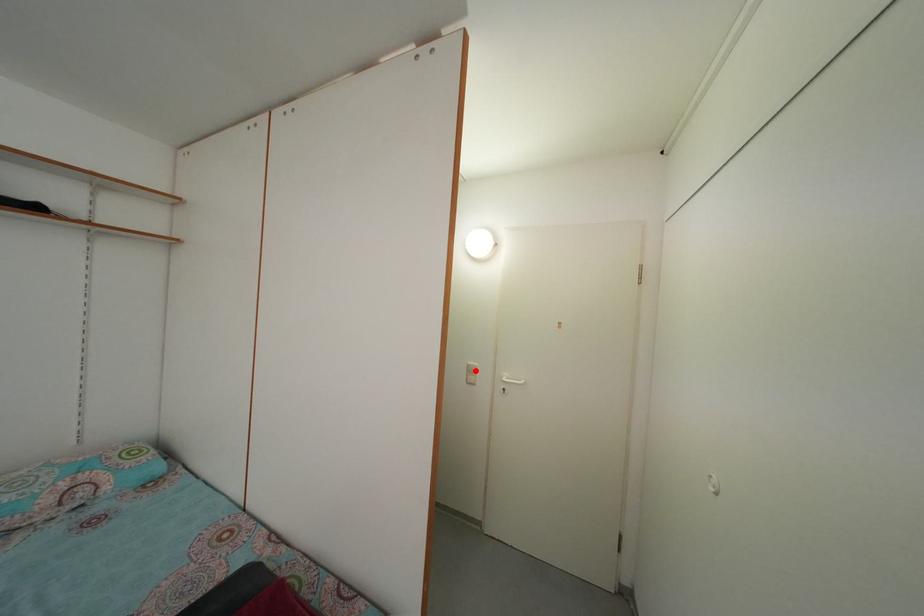
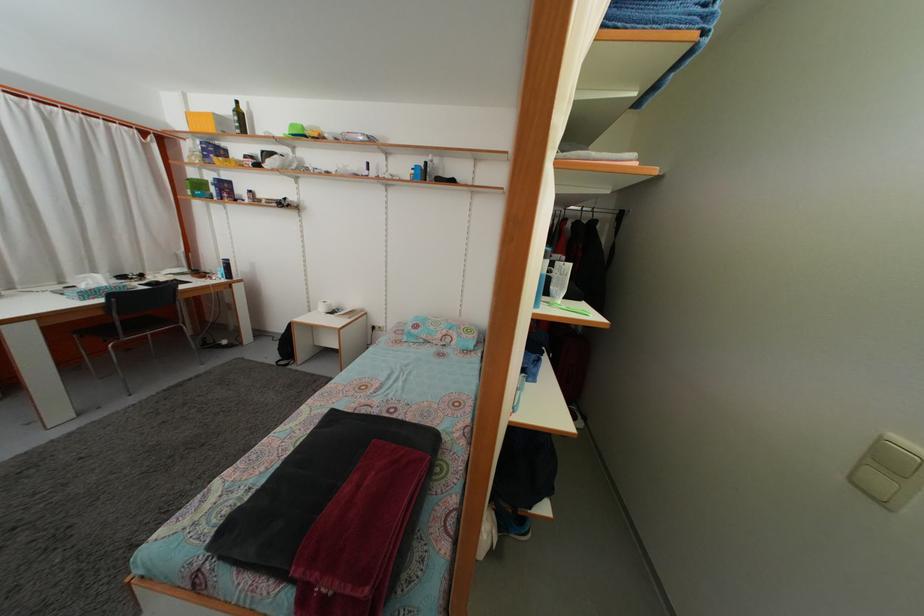
Question: I am providing you with two images of the same scene from different viewpoints. A red point is marked on the first image. Can you still see the location of the red point in image 2?

Choices:
 (A) Yes
 (B) No

Answer: (A)